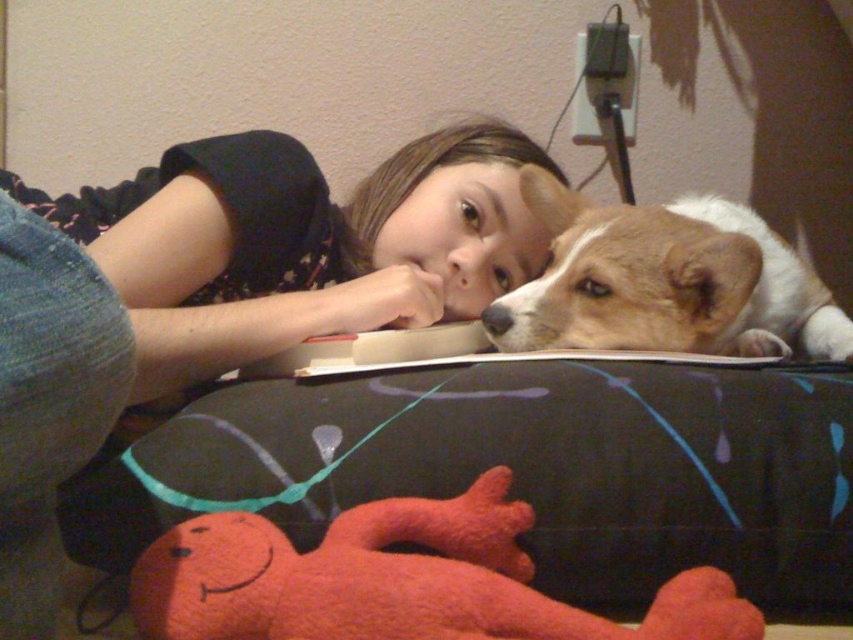
In the scene shown: You are a photographer setting up a shoot in this room. You need to place a small prop between the black fabric pillow at lower center and the matte black shirt at upper center. Based on their positions, where should you place the prop to ensure it is between them?

The black fabric pillow at lower center is positioned under the matte black shirt at upper center, so placing the prop between them would require positioning it above the pillow and below the shirt to maintain the spatial relationship.

You are a robotic arm trying to place a small toy between the black fabric pillow at lower center and the matte black shirt at upper center. The toy is 10 inches long. Can you fit it between them without moving either object?

The distance between the black fabric pillow at lower center and the matte black shirt at upper center is 9.43 inches. Since the toy is 10 inches long, it cannot fit between them without moving either object.

You are a photographer trying to capture a candid shot of the girl and her dog. You want to ensure the matte black shirt at upper center and the brown and white fur at upper right are both in the frame. Based on their positions, which object should you focus on first to include both in the shot?

The matte black shirt at upper center is to the left of brown and white fur at upper right, so focusing on the matte black shirt at upper center first would ensure both objects are included in the shot since it is positioned to the left of the other object.